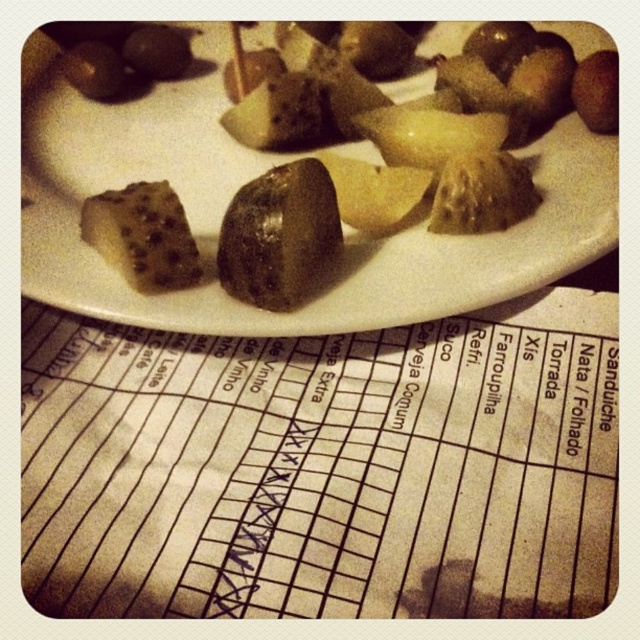
Question: Does green matte olive at center appear on the left side of black glossy olive at upper left?

Choices:
 (A) no
 (B) yes

Answer: (A)

Question: Is greenish-yellow pickled at upper center to the right of black glossy olive at upper left from the viewer's perspective?

Choices:
 (A) yes
 (B) no

Answer: (A)

Question: Which of the following is the closest to the observer?

Choices:
 (A) (141, 42)
 (B) (609, 42)
 (C) (220, 253)

Answer: (C)

Question: Which object appears closest to the camera in this image?

Choices:
 (A) green matte olive at center
 (B) greenish-yellow pickled at upper center
 (C) green glossy pickle at center

Answer: (C)

Question: Does green glossy pickle at center appear on the right side of green matte olive at center?

Choices:
 (A) yes
 (B) no

Answer: (A)

Question: Which object is closer to the camera taking this photo?

Choices:
 (A) green glossy pickle at center
 (B) green matte olive at center
 (C) greenish-yellow pickled at upper center

Answer: (A)